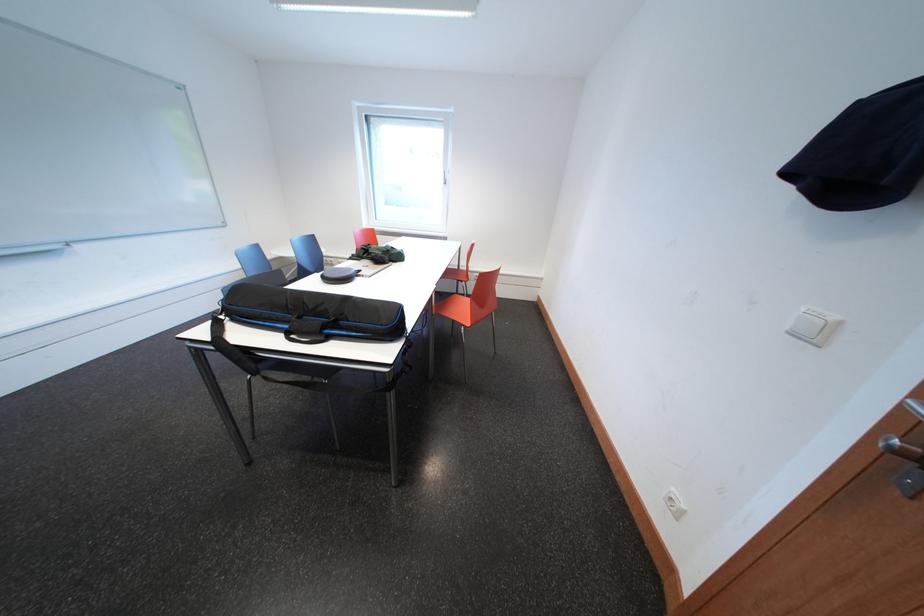
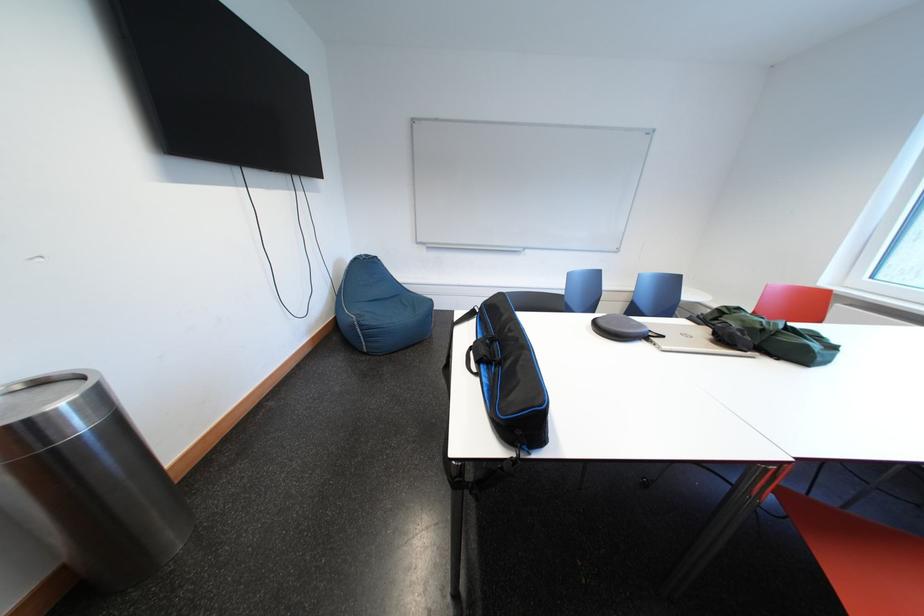
Find the pixel in the second image that matches (x=367, y=278) in the first image.

(657, 341)